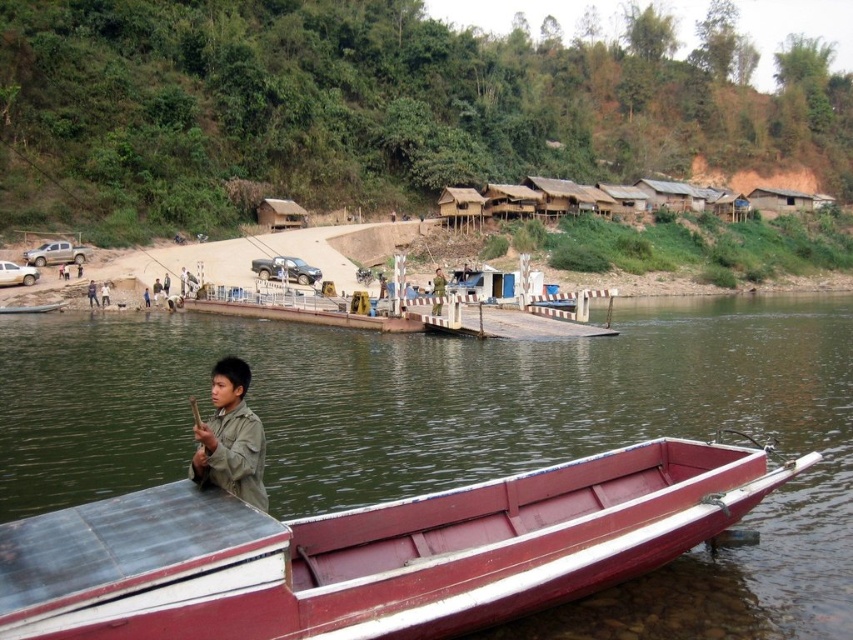
Is smooth red wood boat at lower center wider than green matte shirt at lower left?

Indeed, smooth red wood boat at lower center has a greater width compared to green matte shirt at lower left.

Which is behind, point (401, 541) or point (247, 442)?

Point (401, 541)

Does point (242, 632) come behind point (238, 454)?

No, (242, 632) is in front of (238, 454).

This screenshot has width=853, height=640. Identify the location of smooth red wood boat at lower center. (370, 550).